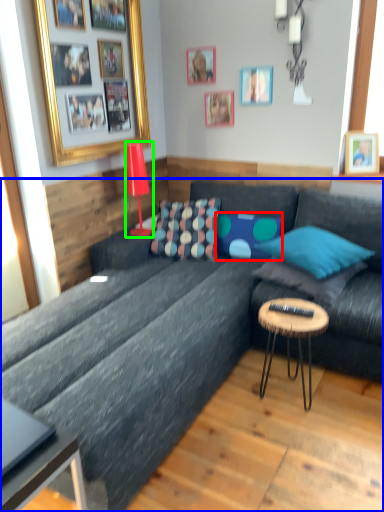
Question: Estimate the real-world distances between objects in this image. Which object is farther from pillow (highlighted by a red box), studio couch (highlighted by a blue box) or lamp (highlighted by a green box)?

Choices:
 (A) studio couch
 (B) lamp

Answer: (A)